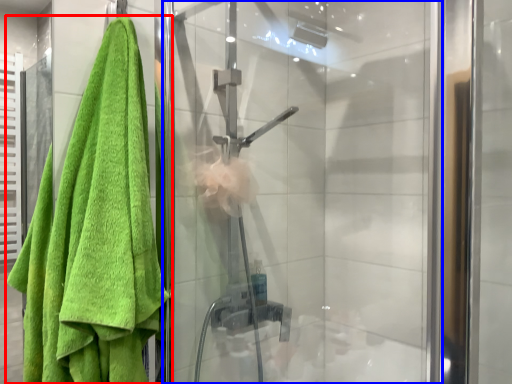
Question: Which object is closer to the camera taking this photo, towel (highlighted by a red box) or screen door (highlighted by a blue box)?

Choices:
 (A) towel
 (B) screen door

Answer: (A)